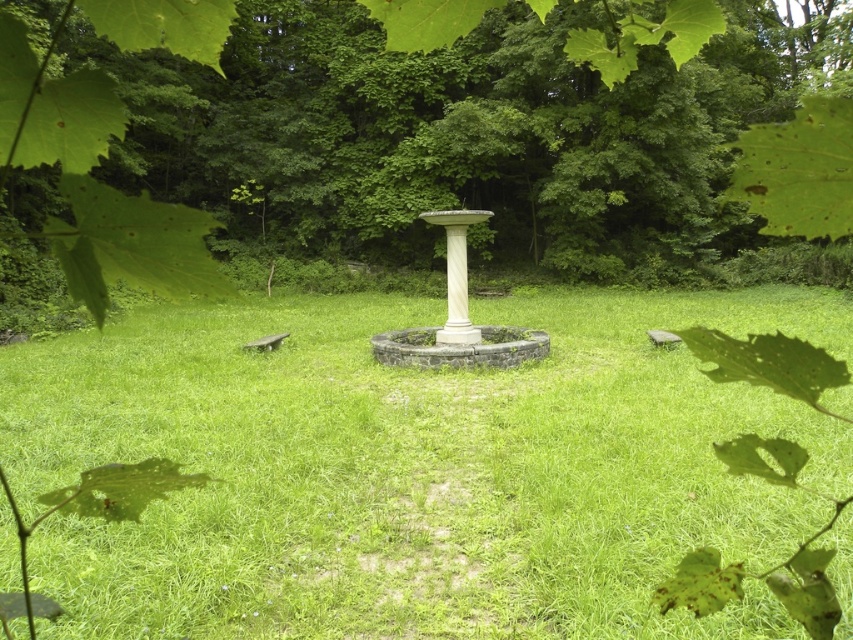
Can you confirm if green grassy at center is shorter than green leafy tree at center?

Yes, green grassy at center is shorter than green leafy tree at center.

Can you confirm if green grassy at center is smaller than green leafy tree at center?

Yes, green grassy at center is smaller than green leafy tree at center.

Between point (335, 385) and point (607, 92), which one is positioned behind?

Point (607, 92)

Identify the location of green grassy at center. The image size is (853, 640). (415, 468).